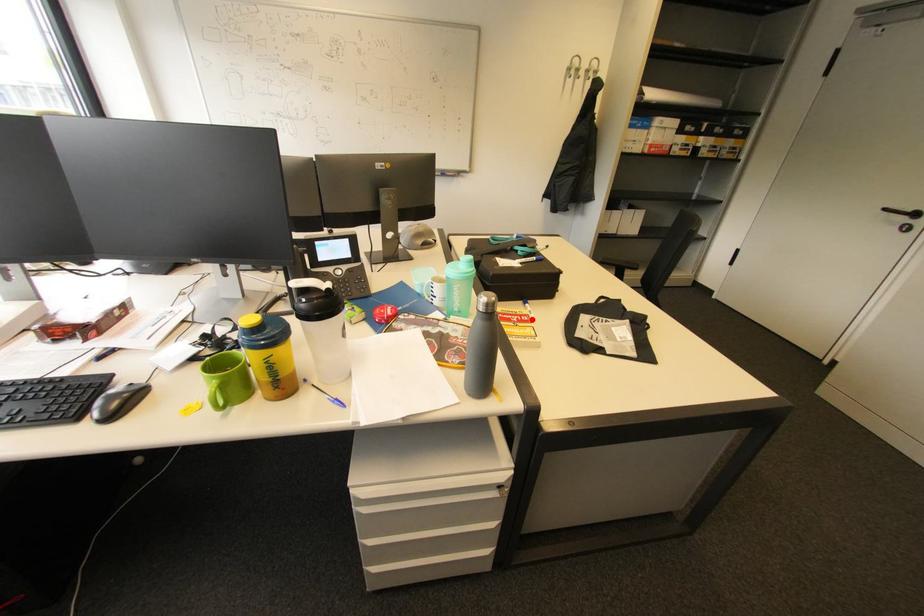
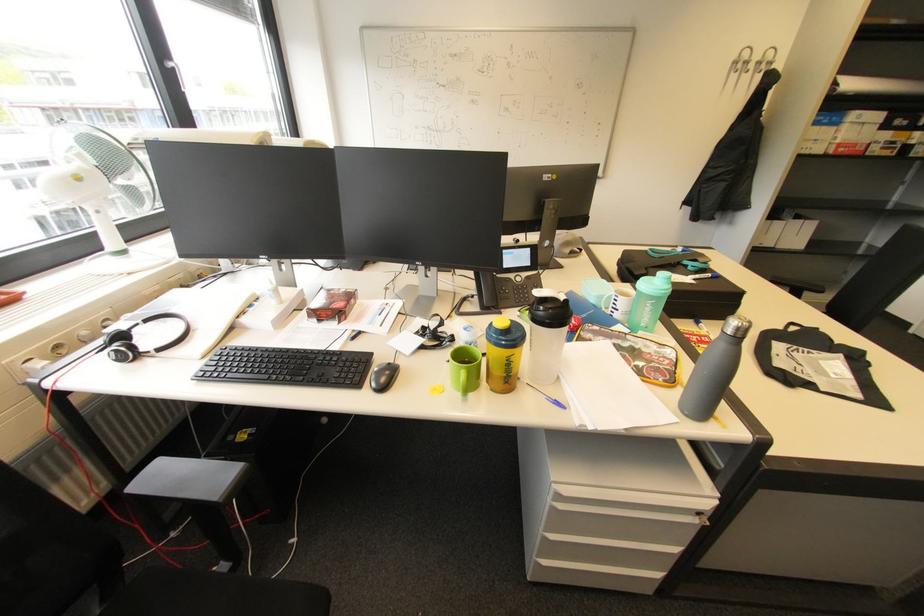
Find the pixel in the second image that matches the highlighted location in the first image.

(713, 341)